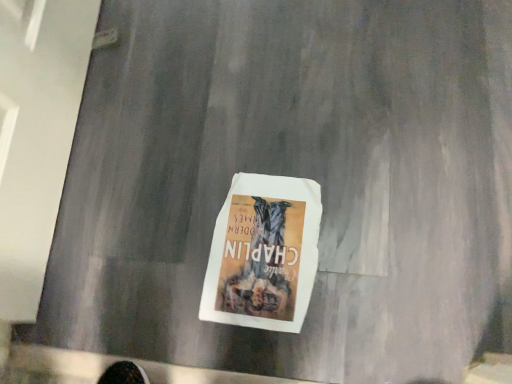
The image size is (512, 384). In order to click on vacant point above white paper at center (from a real-world perspective) in this screenshot , I will do `click(257, 253)`.